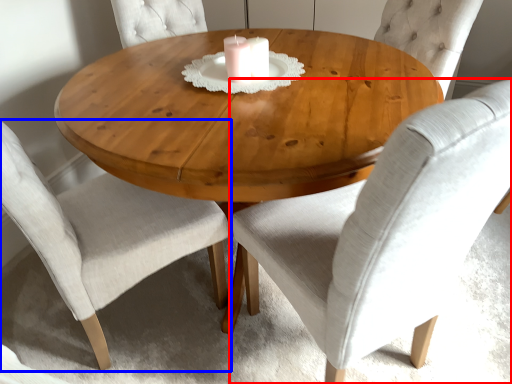
Question: Which of the following is the farthest to the observer, chair (highlighted by a red box) or chair (highlighted by a blue box)?

Choices:
 (A) chair
 (B) chair

Answer: (B)